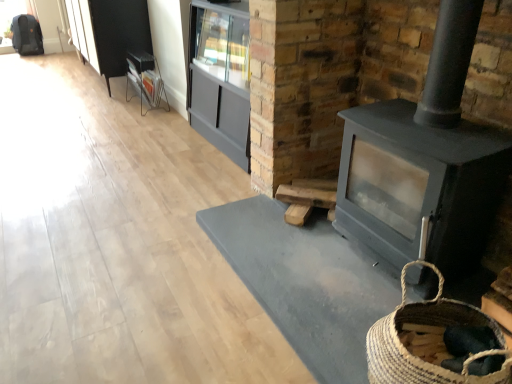
What is the approximate width of natural woven basket at lower right?

It is 15.52 inches.

Measure the distance between natural woven basket at lower right and camera.

natural woven basket at lower right is 36.28 inches away from camera.

The width and height of the screenshot is (512, 384). I want to click on metallic silver magazine rack at upper left, so click(146, 78).

Locate an element on the screen. The height and width of the screenshot is (384, 512). matte gray wood burning stove at right is located at coordinates (426, 162).

Considering the positions of point (476, 88) and point (209, 54), is point (476, 88) closer or farther from the camera than point (209, 54)?

Point (476, 88).

Are matte gray wood burning stove at right and matte gray cabinet at center far apart?

That's right, there is a large distance between matte gray wood burning stove at right and matte gray cabinet at center.

Is matte gray wood burning stove at right smaller than matte gray cabinet at center?

Yes, matte gray wood burning stove at right is smaller than matte gray cabinet at center.

Are metallic silver magazine rack at upper left and matte gray wood burning stove at right located far from each other?

Indeed, metallic silver magazine rack at upper left is not near matte gray wood burning stove at right.

Would you say metallic silver magazine rack at upper left is to the left or to the right of matte gray wood burning stove at right in the picture?

Based on their positions, metallic silver magazine rack at upper left is located to the left of matte gray wood burning stove at right.

Does metallic silver magazine rack at upper left have a greater width compared to natural woven basket at lower right?

No.

From a real-world perspective, is metallic silver magazine rack at upper left positioned over natural woven basket at lower right based on gravity?

No, from a real-world perspective, metallic silver magazine rack at upper left is not on top of natural woven basket at lower right.

Find the location of a particular element. The image size is (512, 384). basket in front of the metallic silver magazine rack at upper left is located at coordinates (429, 325).

Considering their positions, is metallic silver magazine rack at upper left located in front of or behind natural woven basket at lower right?

metallic silver magazine rack at upper left is behind natural woven basket at lower right.

Which object is positioned more to the right, matte gray wood burning stove at right or natural woven basket at lower right?

From the viewer's perspective, matte gray wood burning stove at right appears more on the right side.

In the scene shown: What's the angular difference between matte gray wood burning stove at right and natural woven basket at lower right's facing directions?

There is a 0.00137-degree angle between the facing directions of matte gray wood burning stove at right and natural woven basket at lower right.

Looking at this image, is matte gray wood burning stove at right bigger than natural woven basket at lower right?

Correct, matte gray wood burning stove at right is larger in size than natural woven basket at lower right.

From a real-world perspective, is matte gray wood burning stove at right on natural woven basket at lower right?

Yes, from a real-world perspective, matte gray wood burning stove at right is on top of natural woven basket at lower right.

In the image, is matte gray cabinet at center on the left side or the right side of matte gray wood burning stove at right?

matte gray cabinet at center is positioned on matte gray wood burning stove at right's left side.

Measure the distance from matte gray cabinet at center to matte gray wood burning stove at right.

The distance of matte gray cabinet at center from matte gray wood burning stove at right is 3.98 feet.

Which is correct: matte gray cabinet at center is inside matte gray wood burning stove at right, or outside of it?

matte gray cabinet at center is spatially situated outside matte gray wood burning stove at right.

From a real-world perspective, who is located lower, matte gray cabinet at center or matte gray wood burning stove at right?

matte gray cabinet at center is physically lower.

Consider the image. Measure the distance from natural woven basket at lower right to matte gray cabinet at center.

A distance of 5.53 feet exists between natural woven basket at lower right and matte gray cabinet at center.

Is natural woven basket at lower right positioned far away from matte gray cabinet at center?

That's right, there is a large distance between natural woven basket at lower right and matte gray cabinet at center.

Between natural woven basket at lower right and matte gray cabinet at center, which one is positioned in front?

natural woven basket at lower right.

Who is shorter, natural woven basket at lower right or matte gray cabinet at center?

Standing shorter between the two is natural woven basket at lower right.

Could you tell me if natural woven basket at lower right is turned towards metallic silver magazine rack at upper left?

No.

From the image's perspective, is natural woven basket at lower right on top of metallic silver magazine rack at upper left?

No, from the image's perspective, natural woven basket at lower right is not over metallic silver magazine rack at upper left.

Is natural woven basket at lower right inside the boundaries of metallic silver magazine rack at upper left, or outside?

natural woven basket at lower right is not inside metallic silver magazine rack at upper left, it's outside.

From their relative heights in the image, would you say natural woven basket at lower right is taller or shorter than metallic silver magazine rack at upper left?

In the image, natural woven basket at lower right appears to be shorter than metallic silver magazine rack at upper left.

The image size is (512, 384). Find the location of `wood burning stove that appears on the right of matte gray cabinet at center`. wood burning stove that appears on the right of matte gray cabinet at center is located at coordinates (426, 162).

Identify the location of furniture behind the matte gray wood burning stove at right. This screenshot has height=384, width=512. (146, 78).

When comparing their distances from natural woven basket at lower right, does matte gray wood burning stove at right or matte gray cabinet at center seem further?

matte gray cabinet at center.

Estimate the real-world distances between objects in this image. Which object is further from metallic silver magazine rack at upper left, matte gray cabinet at center or matte gray wood burning stove at right?

matte gray wood burning stove at right lies further to metallic silver magazine rack at upper left than the other object.

Considering their positions, is natural woven basket at lower right positioned closer to matte gray wood burning stove at right than metallic silver magazine rack at upper left?

The object closer to matte gray wood burning stove at right is natural woven basket at lower right.

Considering their positions, is metallic silver magazine rack at upper left positioned further to matte gray wood burning stove at right than matte gray cabinet at center?

Among the two, metallic silver magazine rack at upper left is located further to matte gray wood burning stove at right.

Which object lies further to the anchor point metallic silver magazine rack at upper left, matte gray cabinet at center or natural woven basket at lower right?

natural woven basket at lower right lies further to metallic silver magazine rack at upper left than the other object.

Looking at the image, which one is located closer to matte gray cabinet at center, metallic silver magazine rack at upper left or natural woven basket at lower right?

metallic silver magazine rack at upper left.

Based on their spatial positions, is metallic silver magazine rack at upper left or natural woven basket at lower right further from matte gray wood burning stove at right?

metallic silver magazine rack at upper left.

Which object lies further to the anchor point matte gray wood burning stove at right, matte gray cabinet at center or metallic silver magazine rack at upper left?

The object further to matte gray wood burning stove at right is metallic silver magazine rack at upper left.

This screenshot has height=384, width=512. What are the coordinates of `wood burning stove between natural woven basket at lower right and metallic silver magazine rack at upper left in the front-back direction` in the screenshot? It's located at (426, 162).

Identify the location of wood burning stove between natural woven basket at lower right and matte gray cabinet at center along the z-axis. (426, 162).

Locate an element on the screen. entertainment center positioned between natural woven basket at lower right and metallic silver magazine rack at upper left from near to far is located at coordinates pos(220,78).

Where is `entertainment center between matte gray wood burning stove at right and metallic silver magazine rack at upper left in the front-back direction`? The image size is (512, 384). entertainment center between matte gray wood burning stove at right and metallic silver magazine rack at upper left in the front-back direction is located at coordinates (220, 78).